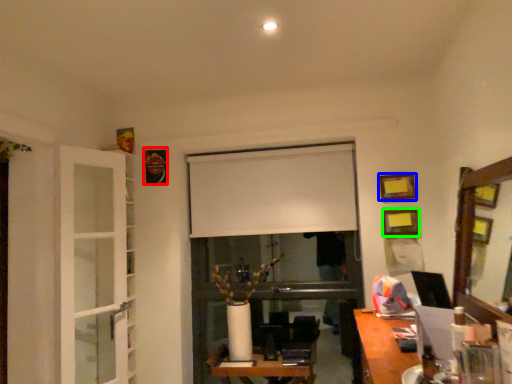
Question: Which object is the closest to the picture frame (highlighted by a red box)? Choose among these: picture frame (highlighted by a blue box) or picture frame (highlighted by a green box).

Choices:
 (A) picture frame
 (B) picture frame

Answer: (A)